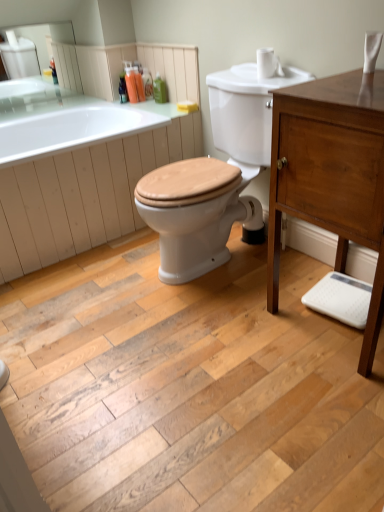
I want to click on free location in front of green plastic bottle at upper center, placed as the 1th toiletry when sorted from right to left, so click(x=167, y=103).